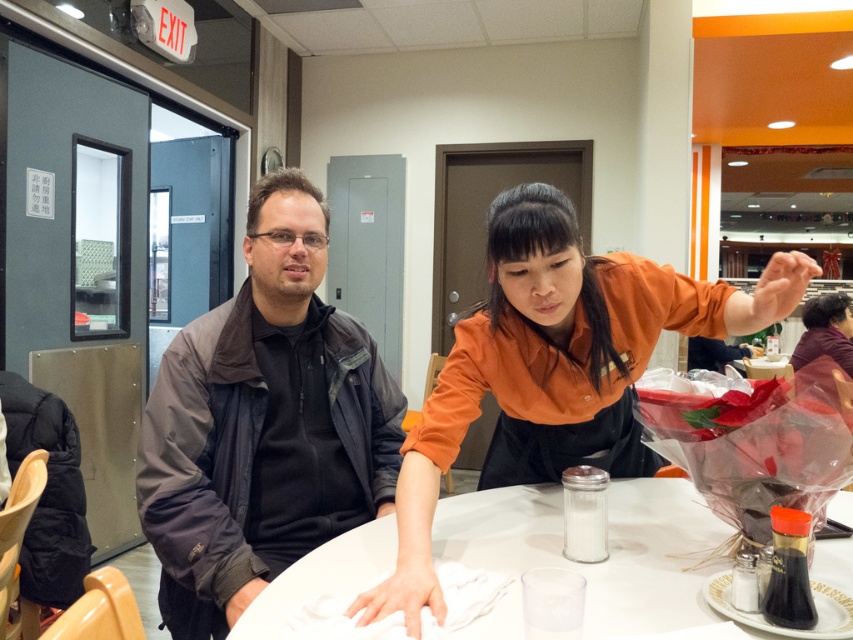
Is dark gray jacket at center taller than white glossy table at center?

Correct, dark gray jacket at center is much taller as white glossy table at center.

Is dark gray jacket at center behind white glossy table at center?

That is True.

Is point (204, 582) behind point (621, 518)?

That is False.

Where is `dark gray jacket at center`? This screenshot has width=853, height=640. dark gray jacket at center is located at coordinates (263, 422).

Which is in front, point (412, 538) or point (686, 506)?

Point (412, 538) is more forward.

Between point (645, 330) and point (277, 627), which one is positioned behind?

The point (645, 330) is behind.

Locate an element on the screen. The image size is (853, 640). orange shirt at center is located at coordinates (554, 369).

Is dark gray jacket at center shorter than orange shirt at center?

No, dark gray jacket at center is not shorter than orange shirt at center.

Does dark gray jacket at center have a lesser width compared to orange shirt at center?

Yes.

Is point (164, 544) farther from camera compared to point (426, 572)?

Yes, point (164, 544) is behind point (426, 572).

Locate an element on the screen. This screenshot has height=640, width=853. dark gray jacket at center is located at coordinates (263, 422).